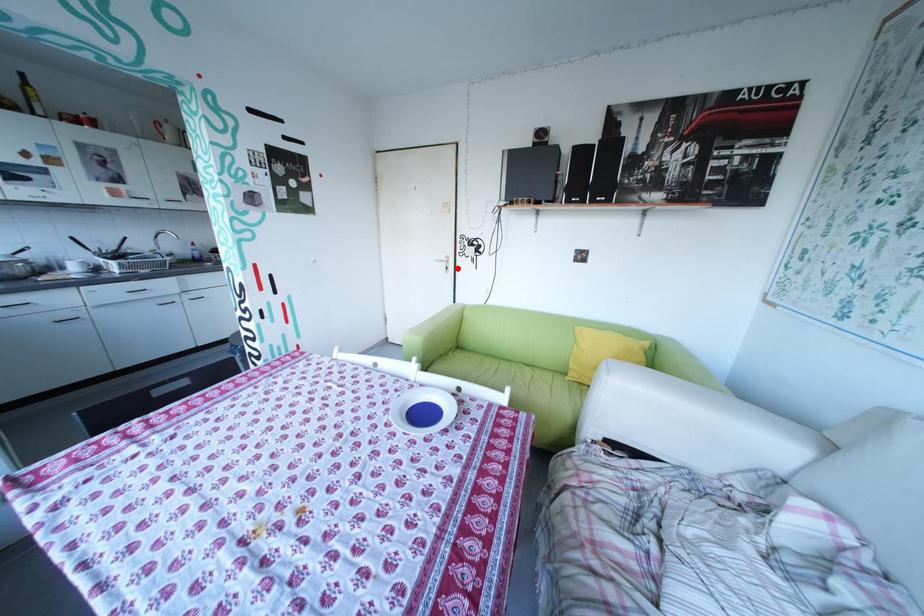
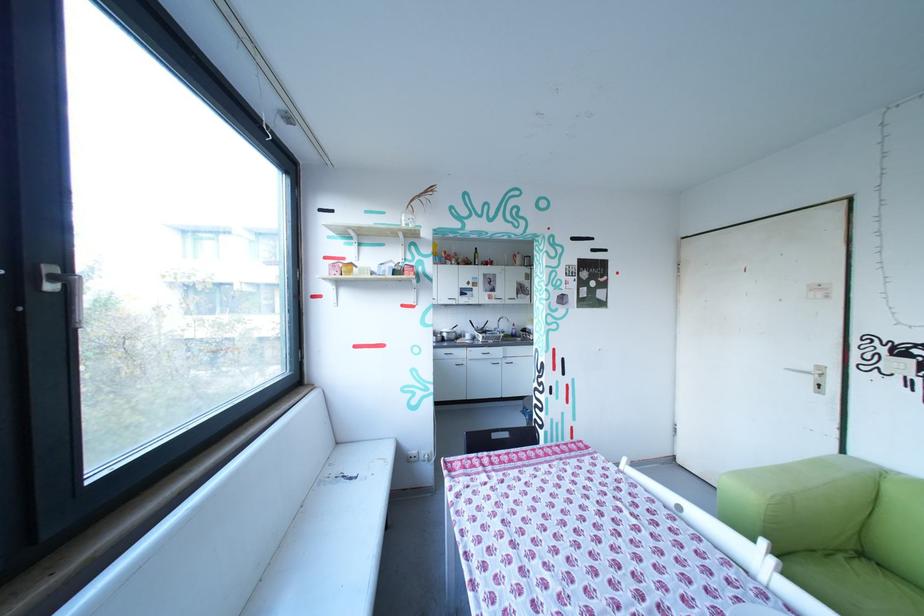
The point at the highlighted location is marked in the first image. Where is the corresponding point in the second image?

(825, 385)